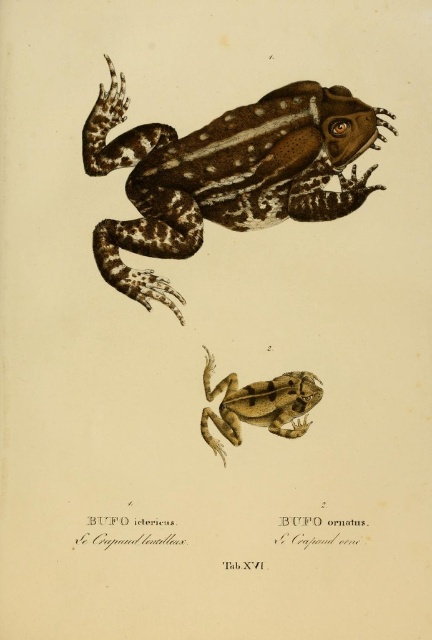
Question: Can you confirm if brown spotted skin frog at upper center is thinner than brown textured frog at center?

Choices:
 (A) yes
 (B) no

Answer: (B)

Question: Can you confirm if brown spotted skin frog at upper center is wider than brown textured frog at center?

Choices:
 (A) no
 (B) yes

Answer: (B)

Question: Which point is closer to the camera taking this photo?

Choices:
 (A) (266, 208)
 (B) (308, 401)

Answer: (B)

Question: Which point is closer to the camera taking this photo?

Choices:
 (A) (294, 371)
 (B) (352, 154)

Answer: (A)

Question: Is brown spotted skin frog at upper center bigger than brown textured frog at center?

Choices:
 (A) no
 (B) yes

Answer: (B)